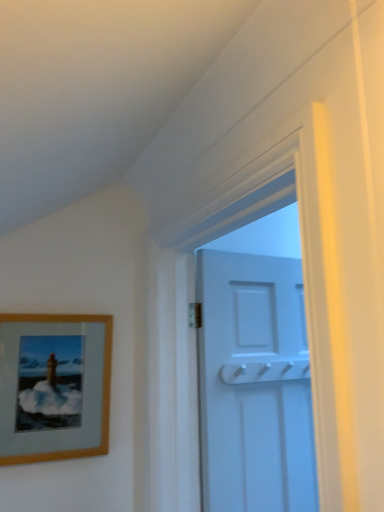
Measure the distance between wooden picture frame at left and camera.

1.16 meters.

This screenshot has height=512, width=384. I want to click on wooden picture frame at left, so click(x=54, y=386).

What do you see at coordinates (54, 386) in the screenshot? This screenshot has height=512, width=384. I see `wooden picture frame at left` at bounding box center [54, 386].

What do you see at coordinates (254, 385) in the screenshot?
I see `white matte door at upper center` at bounding box center [254, 385].

What is the approximate height of white matte door at upper center?

35.02 inches.

Where is `white matte door at upper center`? white matte door at upper center is located at coordinates (254, 385).

At what (x,y) coordinates should I click in order to perform the action: click on wooden picture frame at left. Please return your answer as a coordinate pair (x, y). This screenshot has width=384, height=512. Looking at the image, I should click on (54, 386).

Considering the positions of objects wooden picture frame at left and white matte door at upper center in the image provided, who is more to the right, wooden picture frame at left or white matte door at upper center?

From the viewer's perspective, white matte door at upper center appears more on the right side.

Is wooden picture frame at left positioned behind white matte door at upper center?

No, it is in front of white matte door at upper center.

Is point (97, 413) behind point (214, 399)?

No, (97, 413) is closer to viewer.

From the image's perspective, would you say wooden picture frame at left is shown under white matte door at upper center?

No.

From a real-world perspective, is wooden picture frame at left located beneath white matte door at upper center?

No, from a real-world perspective, wooden picture frame at left is not beneath white matte door at upper center.

Can you confirm if wooden picture frame at left is thinner than white matte door at upper center?

Correct, the width of wooden picture frame at left is less than that of white matte door at upper center.

Which of these two, wooden picture frame at left or white matte door at upper center, stands shorter?

With less height is wooden picture frame at left.

Between wooden picture frame at left and white matte door at upper center, which one has smaller size?

With smaller size is wooden picture frame at left.

Could white matte door at upper center be considered to be inside wooden picture frame at left?

No, wooden picture frame at left does not contain white matte door at upper center.

Are wooden picture frame at left and white matte door at upper center making contact?

No, wooden picture frame at left is not in contact with white matte door at upper center.

Is wooden picture frame at left looking in the opposite direction of white matte door at upper center?

wooden picture frame at left is not turned away from white matte door at upper center.

How much distance is there between wooden picture frame at left and white matte door at upper center?

wooden picture frame at left is 18.03 inches from white matte door at upper center.

At what (x,y) coordinates should I click in order to perform the action: click on door below the wooden picture frame at left (from a real-world perspective). Please return your answer as a coordinate pair (x, y). The width and height of the screenshot is (384, 512). Looking at the image, I should click on (254, 385).

Considering the positions of objects white matte door at upper center and wooden picture frame at left in the image provided, who is more to the right, white matte door at upper center or wooden picture frame at left?

From the viewer's perspective, white matte door at upper center appears more on the right side.

Does white matte door at upper center lie behind wooden picture frame at left?

Yes, white matte door at upper center is behind wooden picture frame at left.

Between point (243, 480) and point (65, 445), which one is positioned in front?

The point (65, 445) is in front.

From the image's perspective, is white matte door at upper center located beneath wooden picture frame at left?

Correct, white matte door at upper center appears lower than wooden picture frame at left in the image.

From a real-world perspective, relative to wooden picture frame at left, is white matte door at upper center vertically above or below?

Clearly, from a real-world perspective, white matte door at upper center is below wooden picture frame at left.

Is white matte door at upper center thinner than wooden picture frame at left?

No.

Does white matte door at upper center have a lesser height compared to wooden picture frame at left?

No.

Does white matte door at upper center have a larger size compared to wooden picture frame at left?

Indeed, white matte door at upper center has a larger size compared to wooden picture frame at left.

Would you say white matte door at upper center contains wooden picture frame at left?

Actually, wooden picture frame at left is outside white matte door at upper center.

Are white matte door at upper center and wooden picture frame at left making contact?

No.

Is white matte door at upper center facing towards wooden picture frame at left?

No, white matte door at upper center is not turned towards wooden picture frame at left.

Can you tell me how much white matte door at upper center and wooden picture frame at left differ in facing direction?

There is a 4.09-degree angle between the facing directions of white matte door at upper center and wooden picture frame at left.

The width and height of the screenshot is (384, 512). Find the location of `door that is under the wooden picture frame at left (from a real-world perspective)`. door that is under the wooden picture frame at left (from a real-world perspective) is located at coordinates (254, 385).

Where is `door that appears behind the wooden picture frame at left`? door that appears behind the wooden picture frame at left is located at coordinates (254, 385).

This screenshot has height=512, width=384. Find the location of `picture frame on the left of white matte door at upper center`. picture frame on the left of white matte door at upper center is located at coordinates (54, 386).